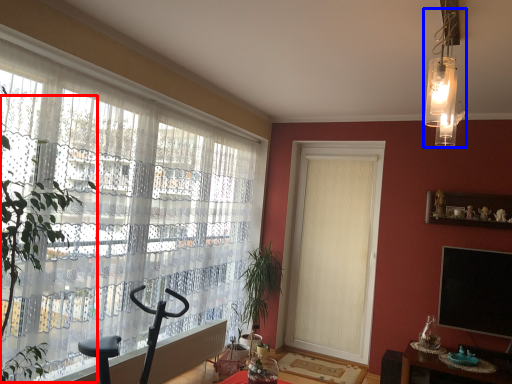
Question: Which object is further to the camera taking this photo, tree (highlighted by a red box) or light fixture (highlighted by a blue box)?

Choices:
 (A) tree
 (B) light fixture

Answer: (B)